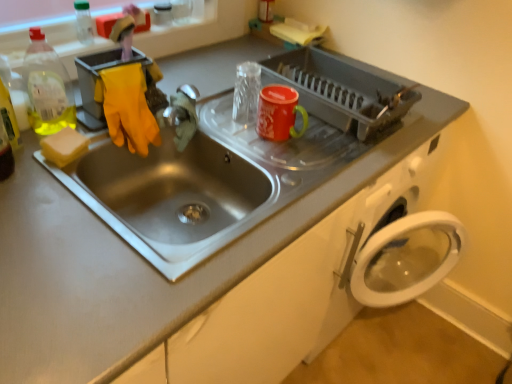
Question: Is yellow sponge at left positioned before metallic silver faucet at sink center?

Choices:
 (A) yes
 (B) no

Answer: (A)

Question: Is yellow sponge at left positioned far away from metallic silver faucet at sink center?

Choices:
 (A) yes
 (B) no

Answer: (B)

Question: Is yellow sponge at left oriented towards metallic silver faucet at sink center?

Choices:
 (A) yes
 (B) no

Answer: (B)

Question: Can you confirm if yellow sponge at left is smaller than metallic silver faucet at sink center?

Choices:
 (A) no
 (B) yes

Answer: (B)

Question: Is yellow sponge at left to the right of metallic silver faucet at sink center from the viewer's perspective?

Choices:
 (A) yes
 (B) no

Answer: (B)

Question: Is matte plastic dish rack at upper center inside the boundaries of translucent plastic bottle at upper left, which ranks as the second bottle in top-to-bottom order, or outside?

Choices:
 (A) inside
 (B) outside

Answer: (B)

Question: Is matte plastic dish rack at upper center bigger or smaller than translucent plastic bottle at upper left, which ranks as the second bottle in top-to-bottom order?

Choices:
 (A) small
 (B) big

Answer: (B)

Question: From a real-world perspective, is matte plastic dish rack at upper center positioned above or below translucent plastic bottle at upper left, which ranks as the second bottle in top-to-bottom order?

Choices:
 (A) above
 (B) below

Answer: (B)

Question: Does point (306, 49) appear closer or farther from the camera than point (32, 31)?

Choices:
 (A) closer
 (B) farther

Answer: (B)

Question: In the image, is translucent plastic bottle at upper left, which ranks as the 2th bottle in back-to-front order, positioned in front of or behind clear plastic bottle at upper left, acting as the first bottle starting from the top?

Choices:
 (A) front
 (B) behind

Answer: (A)

Question: Is translucent plastic bottle at upper left, which is the 1th bottle in front-to-back order, inside the boundaries of clear plastic bottle at upper left, the 2th bottle when ordered from front to back, or outside?

Choices:
 (A) outside
 (B) inside

Answer: (A)

Question: Considering the positions of translucent plastic bottle at upper left, which ranks as the 1th bottle in bottom-to-top order, and clear plastic bottle at upper left, which ranks as the 1th bottle in back-to-front order, in the image, is translucent plastic bottle at upper left, which ranks as the 1th bottle in bottom-to-top order, wider or thinner than clear plastic bottle at upper left, which ranks as the 1th bottle in back-to-front order,?

Choices:
 (A) thin
 (B) wide

Answer: (B)

Question: From a real-world perspective, is translucent plastic bottle at upper left, which ranks as the 2th bottle in back-to-front order, physically located above or below clear plastic bottle at upper left, which is the second bottle in bottom-to-top order?

Choices:
 (A) above
 (B) below

Answer: (B)

Question: Considering their positions, is yellow sponge at left located in front of or behind metallic silver faucet at sink center?

Choices:
 (A) behind
 (B) front

Answer: (B)

Question: From their relative heights in the image, would you say yellow sponge at left is taller or shorter than metallic silver faucet at sink center?

Choices:
 (A) short
 (B) tall

Answer: (A)